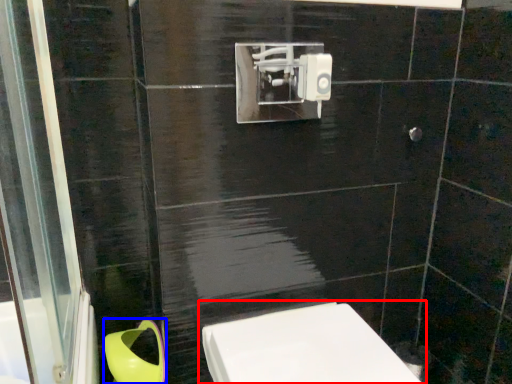
Question: Which object appears farthest to the camera in this image, toilet (highlighted by a red box) or toilet bowl (highlighted by a blue box)?

Choices:
 (A) toilet
 (B) toilet bowl

Answer: (B)